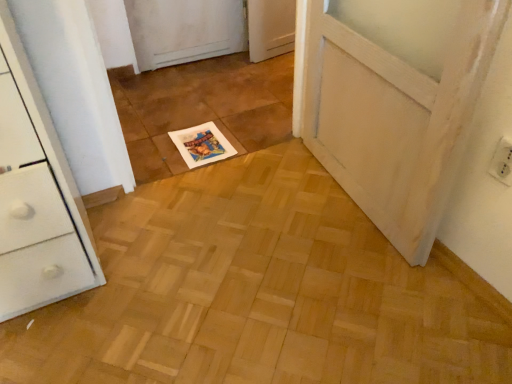
This screenshot has height=384, width=512. I want to click on vacant area on top of white paper magazine at center (from a real-world perspective), so click(198, 137).